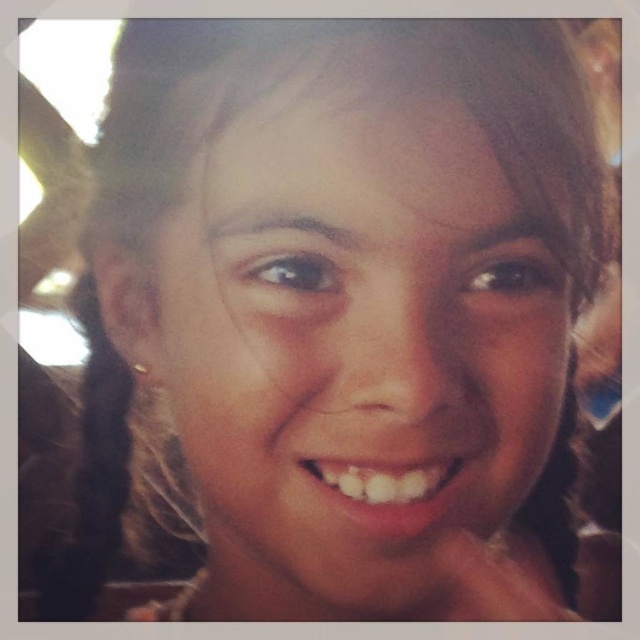
Between smooth skin face at center and black hair at left, which one is positioned higher?

Positioned higher is smooth skin face at center.

How distant is smooth skin face at center from black hair at left?

smooth skin face at center and black hair at left are 7.52 inches apart from each other.

Is point (435, 460) less distant than point (77, 552)?

Yes, it is in front of point (77, 552).

Where is `smooth skin face at center`? The image size is (640, 640). smooth skin face at center is located at coordinates (355, 348).

From the picture: Between black hair at left and white glossy teeth at center, which one appears on the left side from the viewer's perspective?

black hair at left

Which is more to the right, black hair at left or white glossy teeth at center?

Positioned to the right is white glossy teeth at center.

Describe the element at coordinates (93, 472) in the screenshot. I see `black hair at left` at that location.

What are the coordinates of `black hair at left` in the screenshot? It's located at (93, 472).

Can you confirm if smooth skin face at center is positioned to the left of white glossy teeth at center?

Yes, smooth skin face at center is to the left of white glossy teeth at center.

Who is more distant from viewer, [266,288] or [323,490]?

The point [323,490] is more distant.

Where is `smooth skin face at center`? The height and width of the screenshot is (640, 640). smooth skin face at center is located at coordinates (355, 348).